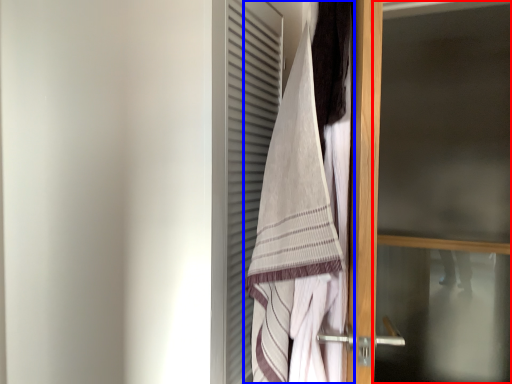
Question: Which of the following is the farthest to the observer, screen door (highlighted by a red box) or towel (highlighted by a blue box)?

Choices:
 (A) screen door
 (B) towel

Answer: (A)